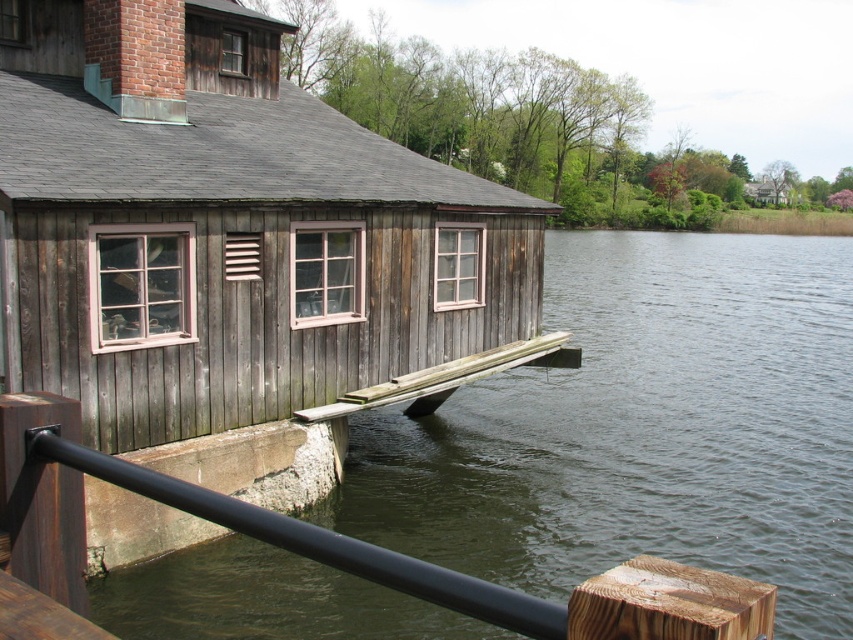
Question: Is weathered wood cabin at center to the right of weathered wood dock at lower center from the viewer's perspective?

Choices:
 (A) no
 (B) yes

Answer: (A)

Question: Observing the image, what is the correct spatial positioning of weathered wood cabin at center in reference to black metal/rail at lower left?

Choices:
 (A) above
 (B) below

Answer: (A)

Question: Which point is closer to the camera taking this photo?

Choices:
 (A) (379, 232)
 (B) (415, 376)

Answer: (A)

Question: Which point appears closest to the camera in this image?

Choices:
 (A) (445, 392)
 (B) (28, 269)
 (C) (410, 577)

Answer: (C)

Question: Does weathered wood cabin at center have a greater width compared to black metal/rail at lower left?

Choices:
 (A) yes
 (B) no

Answer: (A)

Question: Which object is the farthest from the weathered wood dock at lower center?

Choices:
 (A) black metal/rail at lower left
 (B) weathered wood cabin at center

Answer: (A)